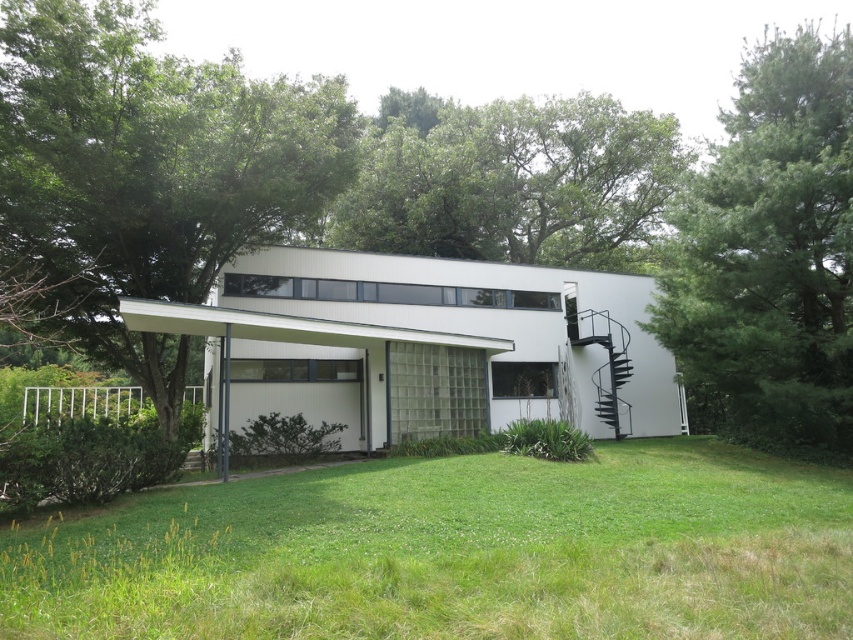
Question: Which object is positioned closest to the green leafy tree at center?

Choices:
 (A) green leafy tree at right
 (B) green leafy tree at upper left
 (C) green grass at lower center

Answer: (A)

Question: Which object appears closest to the camera in this image?

Choices:
 (A) green leafy tree at center
 (B) green grass at lower center

Answer: (B)

Question: Does green grass at lower center appear on the left side of green leafy tree at right?

Choices:
 (A) yes
 (B) no

Answer: (A)

Question: Is green grass at lower center to the right of green leafy tree at upper left from the viewer's perspective?

Choices:
 (A) no
 (B) yes

Answer: (B)

Question: Which of the following is the closest to the observer?

Choices:
 (A) green leafy tree at center
 (B) green leafy tree at right

Answer: (B)

Question: Is green leafy tree at upper left above green leafy tree at center?

Choices:
 (A) no
 (B) yes

Answer: (A)